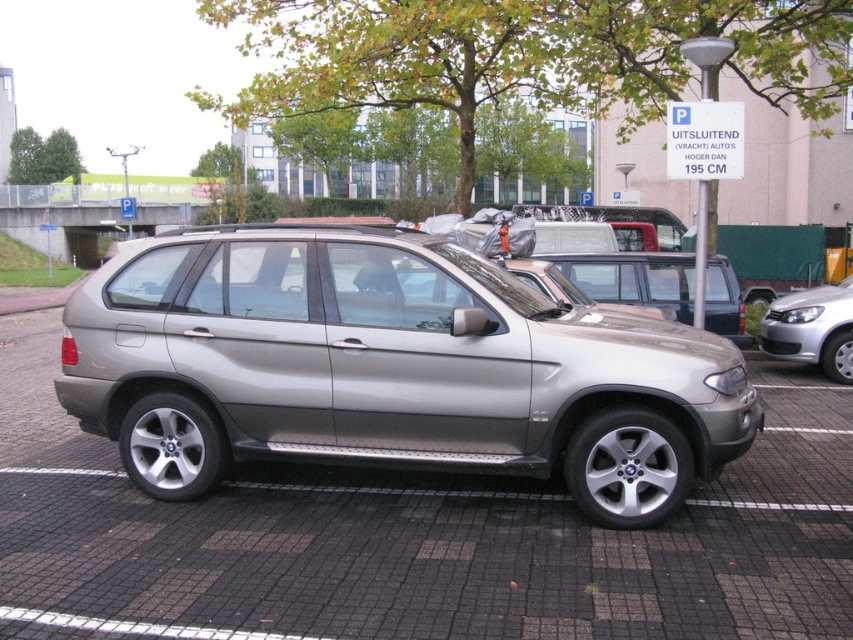
You are a delivery driver who needs to park your truck next to the satin silver minivan at center and the satin silver car at right. Based on their heights, which vehicle should you avoid parking too close to to prevent scraping your truck?

You should avoid parking too close to the satin silver car at right because it is taller than the satin silver minivan at center, which might cause scraping with your truck.

You are a delivery driver who needs to park your 5.2 meter long truck between the satin silver car at center and the satin silver car at right. Can you fit your truck in that space?

The satin silver car at center and satin silver car at right are 4.66 meters apart. Since your truck is 5.2 meters long, it cannot fit in the space between them as the available space is shorter than the truck.